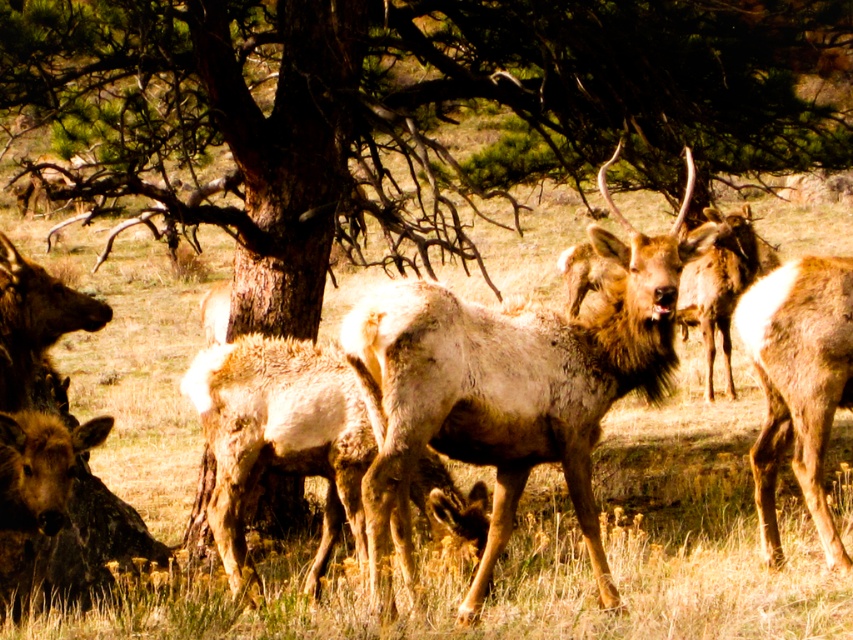
Is point (270, 636) positioned in front of point (468, 449)?

Yes, it is.

Based on the photo, does dry grass at lower left have a smaller size compared to brown fuzzy deer at center?

Yes.

Where is `dry grass at lower left`? The height and width of the screenshot is (640, 853). dry grass at lower left is located at coordinates (x=531, y=576).

Is dry grass at lower left behind brown fur coat at right?

Yes, dry grass at lower left is further from the viewer.

Image resolution: width=853 pixels, height=640 pixels. Identify the location of dry grass at lower left. (531, 576).

Is point (639, 609) positioned after point (817, 497)?

No, (639, 609) is in front of (817, 497).

Image resolution: width=853 pixels, height=640 pixels. Identify the location of dry grass at lower left. (531, 576).

Is point (653, 326) in front of point (761, 477)?

Yes, it is in front of point (761, 477).

The height and width of the screenshot is (640, 853). I want to click on brown fuzzy deer at center, so click(x=509, y=388).